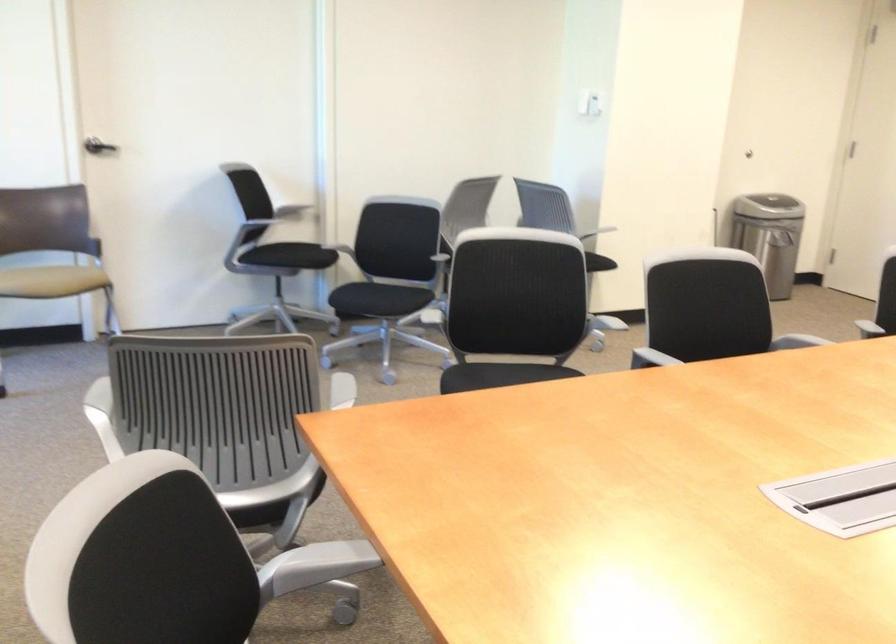
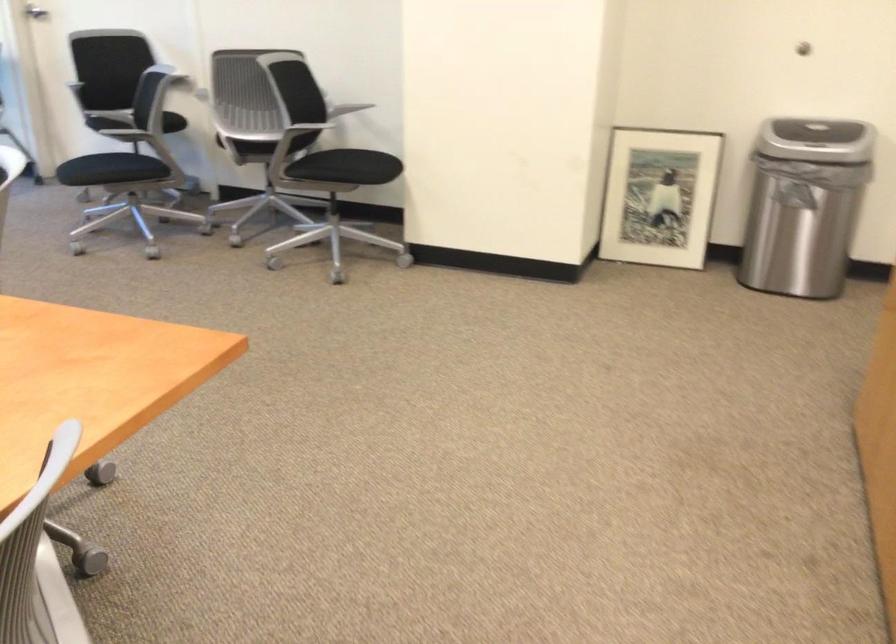
Question: I am providing you with two images of the same scene from different viewpoints. After the viewpoint changes to image2, which objects are now occluded?

Choices:
 (A) chair sitting surface
 (B) orange stuff sack
 (C) trash can lid
 (D) framed picture

Answer: (C)